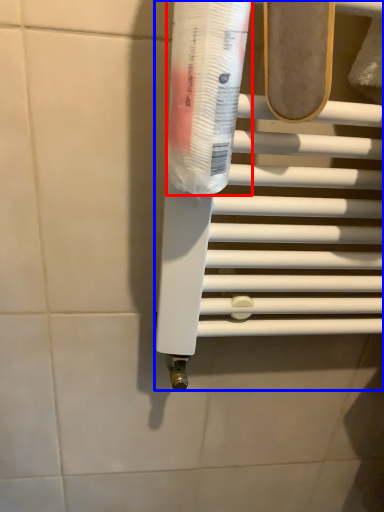
Question: Which object is closer to the camera taking this photo, toothpaste (highlighted by a red box) or towel bar (highlighted by a blue box)?

Choices:
 (A) toothpaste
 (B) towel bar

Answer: (A)